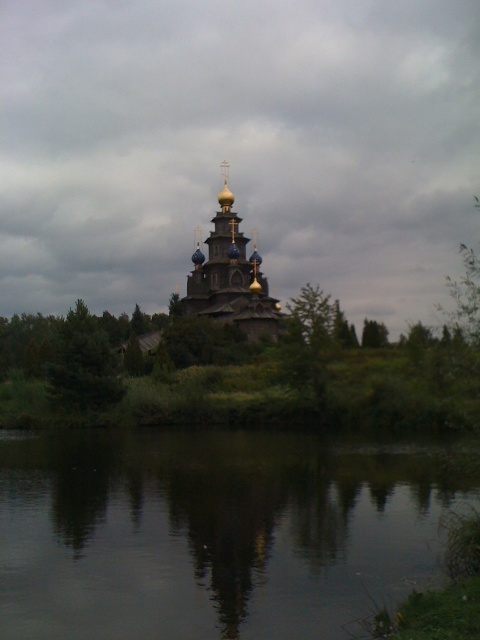
You are standing at the camera position and want to take a photo of the gold domed church at center. If your camera has a maximum focus range of 120 meters, will it be able to capture the church clearly?

The gold domed church at center is 122.90 meters away from the camera. Since the camera can only focus up to 120 meters, it won cannot capture the church clearly within the maximum focus range.

You are standing at the point marked by coordinates point (230, 276) in the image. What structure are you directly facing?

The point (230, 276) indicates the gold domed church at center, so you are directly facing the gold domed church at center.